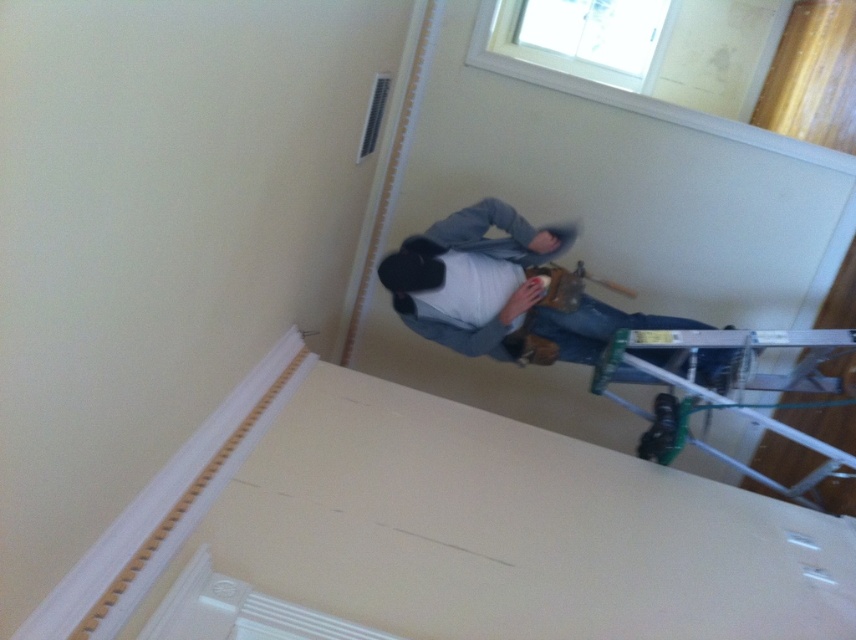
Question: Which point is closer to the camera taking this photo?

Choices:
 (A) (724, 337)
 (B) (449, 216)

Answer: (A)

Question: Among these objects, which one is farthest from the camera?

Choices:
 (A) denim jacket at upper right
 (B) metallic silver ladder at lower right

Answer: (A)

Question: Can you confirm if denim jacket at upper right is bigger than metallic silver ladder at lower right?

Choices:
 (A) yes
 (B) no

Answer: (B)

Question: Can you confirm if denim jacket at upper right is bigger than metallic silver ladder at lower right?

Choices:
 (A) yes
 (B) no

Answer: (B)

Question: Does denim jacket at upper right have a larger size compared to metallic silver ladder at lower right?

Choices:
 (A) no
 (B) yes

Answer: (A)